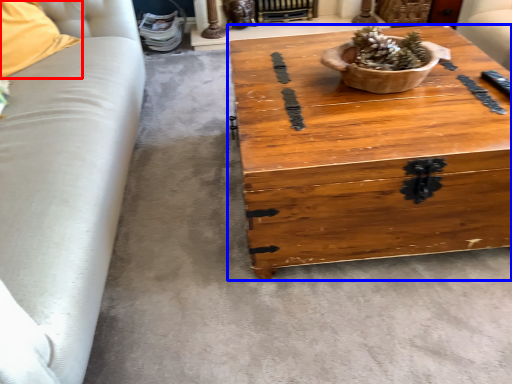
Question: Which object is further to the camera taking this photo, pillow (highlighted by a red box) or coffee table (highlighted by a blue box)?

Choices:
 (A) pillow
 (B) coffee table

Answer: (A)